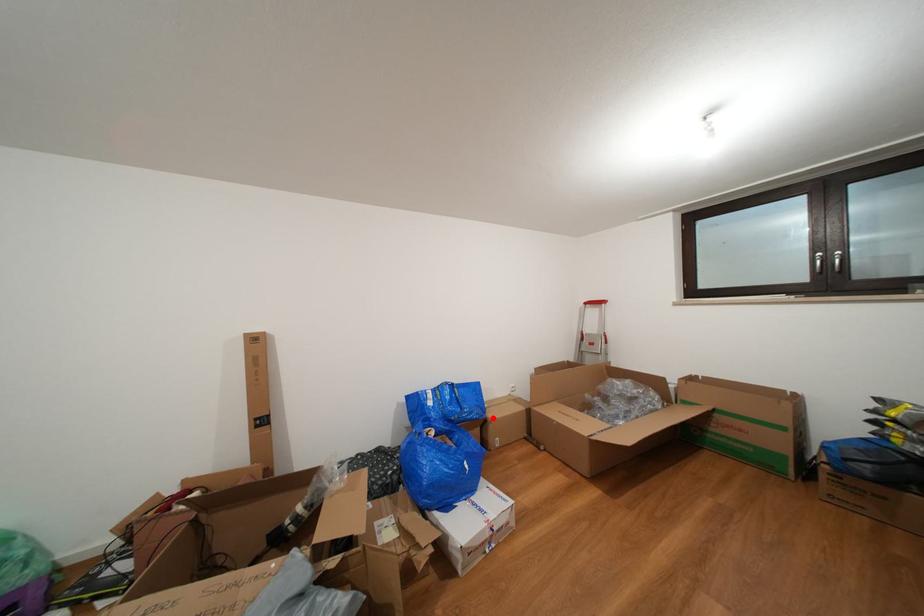
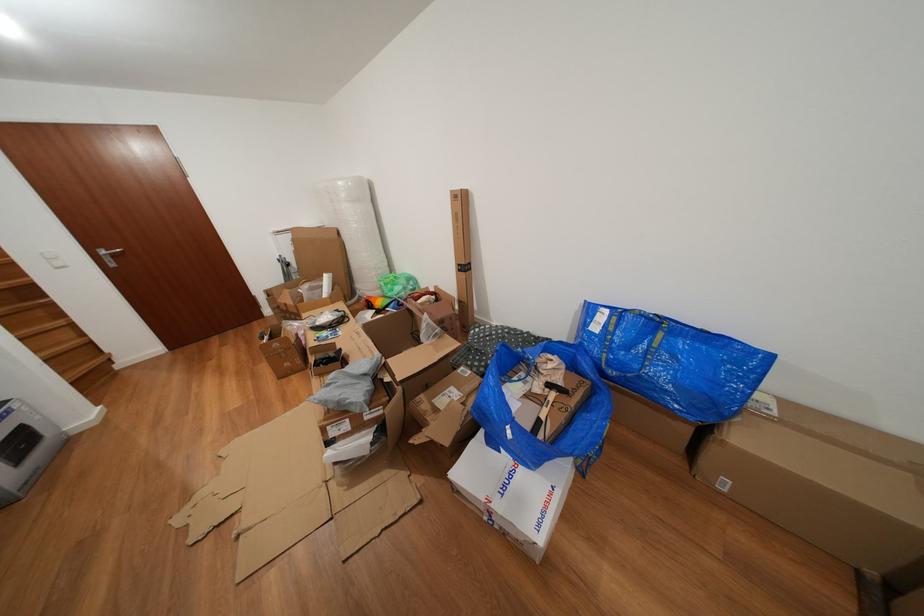
Question: I am providing you with two images of the same scene from different viewpoints. A red point is shown in image1. For the corresponding object point in image2, is it positioned nearer or farther from the camera?

Choices:
 (A) Nearer
 (B) Farther

Answer: (A)